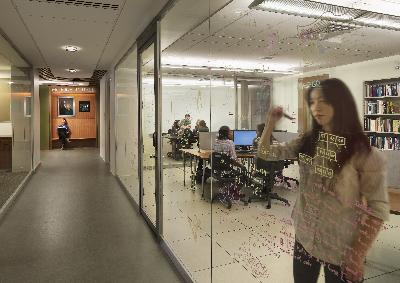
Image resolution: width=400 pixels, height=283 pixels. I want to click on computer screen, so click(245, 140), click(208, 142).